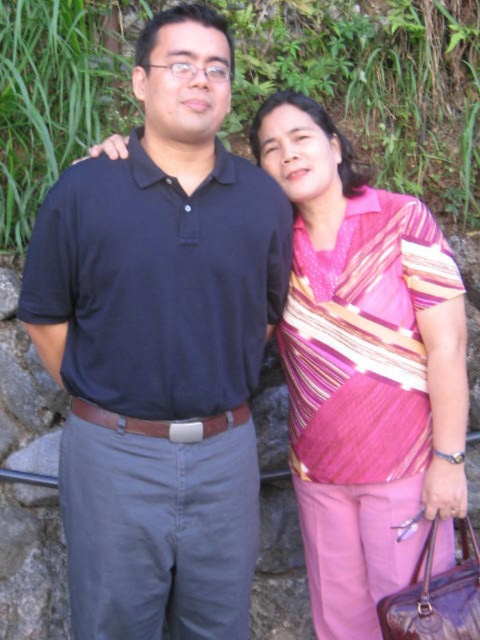
Question: Is matte black shirt at center positioned before pink striped blouse at center?

Choices:
 (A) yes
 (B) no

Answer: (A)

Question: Which point appears farthest from the camera in this image?

Choices:
 (A) (397, 221)
 (B) (66, 348)

Answer: (A)

Question: Is matte black shirt at center in front of pink striped blouse at center?

Choices:
 (A) yes
 (B) no

Answer: (A)

Question: Is matte black shirt at center to the right of pink striped blouse at center from the viewer's perspective?

Choices:
 (A) no
 (B) yes

Answer: (A)